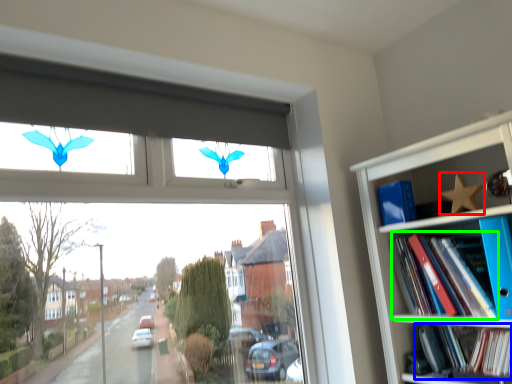
Question: Considering the real-world distances, which object is farthest from butterfly (highlighted by a red box)? book (highlighted by a blue box) or book (highlighted by a green box)?

Choices:
 (A) book
 (B) book

Answer: (A)